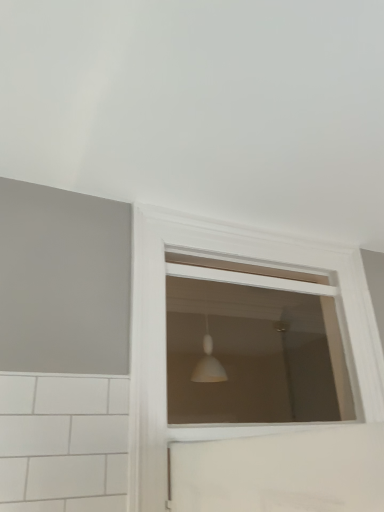
Question: Considering the positions of point (147, 224) and point (168, 344), is point (147, 224) closer or farther from the camera than point (168, 344)?

Choices:
 (A) farther
 (B) closer

Answer: (B)

Question: Based on their positions, is white matte window at center, placed as the 2th window when sorted from top to bottom, located to the left or right of white matte window at center, acting as the 1th window starting from the top?

Choices:
 (A) right
 (B) left

Answer: (A)

Question: Relative to white matte window at center, acting as the 1th window starting from the top, is white matte window at center, which is the 1th window from bottom to top, in front or behind?

Choices:
 (A) front
 (B) behind

Answer: (A)

Question: Is white matte window at center, acting as the 1th window starting from the top, taller or shorter than white matte window at center, placed as the 2th window when sorted from top to bottom?

Choices:
 (A) tall
 (B) short

Answer: (B)

Question: Considering the relative positions of white matte window at center, acting as the 1th window starting from the top, and white matte window at center, placed as the 2th window when sorted from top to bottom, in the image provided, is white matte window at center, acting as the 1th window starting from the top, to the left or to the right of white matte window at center, placed as the 2th window when sorted from top to bottom,?

Choices:
 (A) left
 (B) right

Answer: (A)

Question: From the image's perspective, is white matte window at center, which is the second window in bottom-to-top order, above or below white matte window at center, which is the 1th window from bottom to top?

Choices:
 (A) below
 (B) above

Answer: (B)

Question: From a real-world perspective, relative to white matte window at center, which is the 1th window from bottom to top, is white matte window at center, acting as the 1th window starting from the top, vertically above or below?

Choices:
 (A) above
 (B) below

Answer: (A)